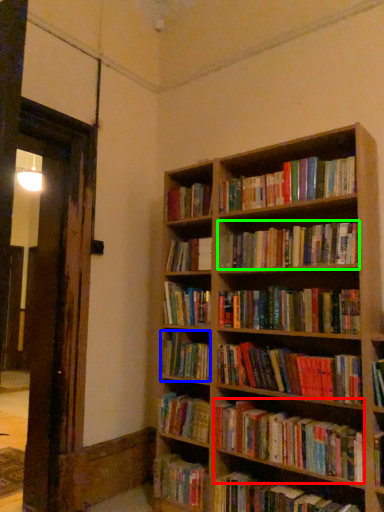
Question: Considering the real-world distances, which object is farthest from book (highlighted by a red box)? book (highlighted by a blue box) or book (highlighted by a green box)?

Choices:
 (A) book
 (B) book

Answer: (B)